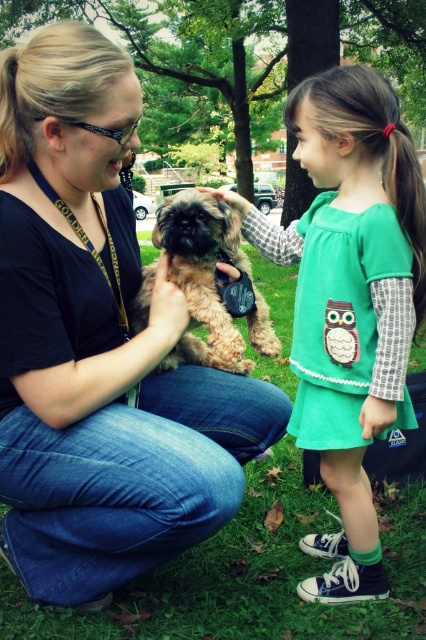
Question: Can you confirm if green fabric dress at center is bigger than green grass at center?

Choices:
 (A) yes
 (B) no

Answer: (B)

Question: Is matte black shirt at center positioned behind green grass at center?

Choices:
 (A) yes
 (B) no

Answer: (B)

Question: Among these points, which one is farthest from the camera?

Choices:
 (A) (397, 369)
 (B) (62, 476)
 (C) (163, 216)
 (D) (126, 618)

Answer: (C)

Question: Among these points, which one is farthest from the camera?

Choices:
 (A) (34, 435)
 (B) (356, 161)
 (C) (195, 205)
 (D) (317, 499)

Answer: (D)

Question: Considering the relative positions of matte black shirt at center and green grass at center in the image provided, where is matte black shirt at center located with respect to green grass at center?

Choices:
 (A) right
 (B) left

Answer: (B)

Question: Which object appears closest to the camera in this image?

Choices:
 (A) matte black shirt at center
 (B) green fabric dress at center
 (C) green grass at center
 (D) fuzzy brown dog at center

Answer: (A)